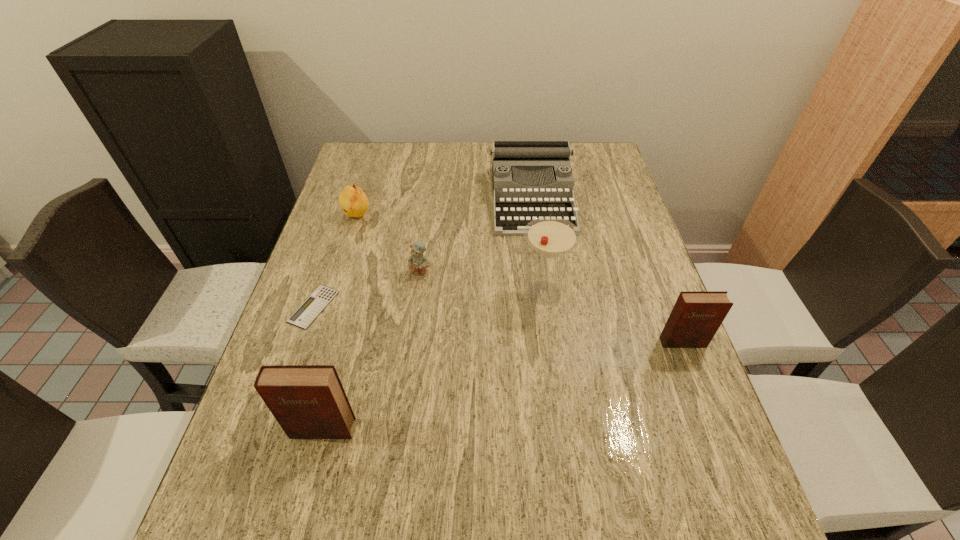
Locate an element on the screen. empty space that is in between the right diary and the pear is located at coordinates (520, 279).

This screenshot has height=540, width=960. Find the location of `vacant space in between the left diary and the typewriter`. vacant space in between the left diary and the typewriter is located at coordinates (427, 314).

Identify the location of free point between the fourth object from right to left and the shortest object. (367, 290).

At what (x,y) coordinates should I click in order to perform the action: click on free spot between the martini and the pear. Please return your answer as a coordinate pair (x, y). Image resolution: width=960 pixels, height=540 pixels. Looking at the image, I should click on (450, 254).

Image resolution: width=960 pixels, height=540 pixels. I want to click on empty space between the fourth object from right to left and the martini, so click(482, 283).

The width and height of the screenshot is (960, 540). Identify the location of empty location between the typewriter and the rightmost object. (607, 271).

Locate an element on the screen. This screenshot has height=540, width=960. blank region between the martini and the rightmost object is located at coordinates (613, 318).

Locate which object is the sixth closest to the typewriter. Please provide its 2D coordinates. Your answer should be formatted as a tuple, i.e. [(x, y)], where the tuple contains the x and y coordinates of a point satisfying the conditions above.

[(308, 401)]

Where is `object that is the fourth nearest to the martini`? object that is the fourth nearest to the martini is located at coordinates (308, 401).

Find the location of a particular element. The height and width of the screenshot is (540, 960). vacant space that satisfies the following two spatial constraints: 1. on the front-facing side of the martini; 2. on the left side of the teddy bear is located at coordinates click(419, 293).